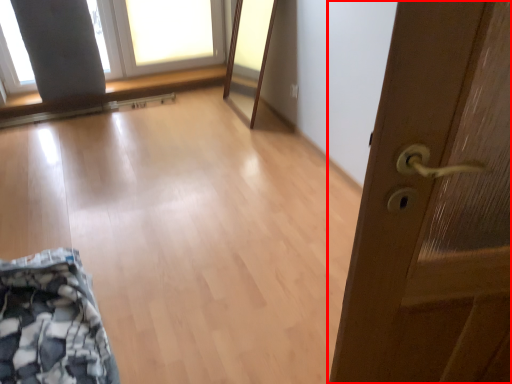
Question: From the image, what is the correct spatial relationship of door (annotated by the red box) in relation to window screen?

Choices:
 (A) right
 (B) left

Answer: (A)